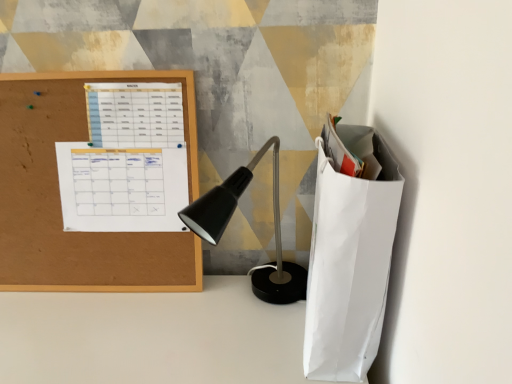
Question: From a real-world perspective, is white paper calendar at upper left, the second notebook viewed from the top, above or below cork board at left?

Choices:
 (A) below
 (B) above

Answer: (A)

Question: In the image, is white paper calendar at upper left, which appears as the 1th notebook when ordered from the bottom, positioned in front of or behind cork board at left?

Choices:
 (A) front
 (B) behind

Answer: (B)

Question: Which object is the closest to the white paper calendar at upper left, arranged as the 2th notebook when ordered from the bottom?

Choices:
 (A) white paper bag at right
 (B) white paper calendar at upper left, which appears as the 1th notebook when ordered from the bottom
 (C) cork board at left

Answer: (B)

Question: Which is nearer to the cork board at left?

Choices:
 (A) white paper bag at right
 (B) white paper calendar at upper left, which appears as the 1th notebook when ordered from the bottom
 (C) white paper calendar at upper left, arranged as the 2th notebook when ordered from the bottom

Answer: (B)